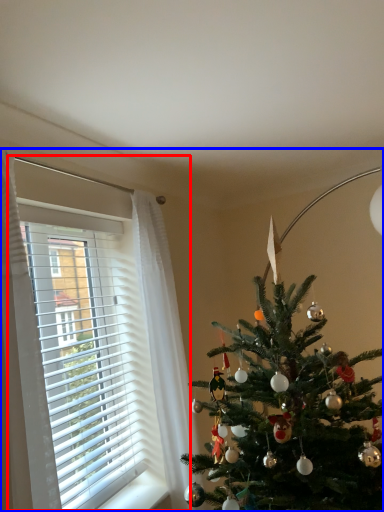
Question: Which object is further to the camera taking this photo, window (highlighted by a red box) or christmas eve (highlighted by a blue box)?

Choices:
 (A) window
 (B) christmas eve

Answer: (A)